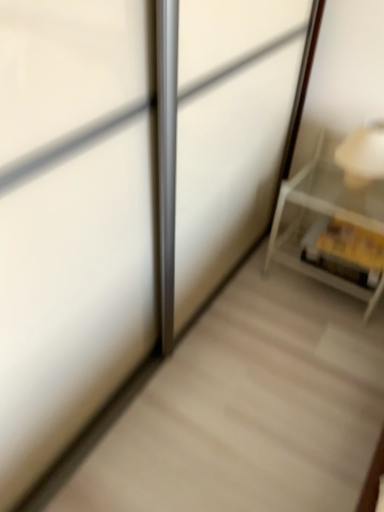
The height and width of the screenshot is (512, 384). Describe the element at coordinates (334, 230) in the screenshot. I see `white glossy side table at right` at that location.

You are a GUI agent. You are given a task and a screenshot of the screen. Output one action in this format:
    pyautogui.click(x=<x>, y=<y>)
    Task: Click on the white glossy side table at right
    Image resolution: width=384 pixels, height=512 pixels.
    Given the screenshot: What is the action you would take?
    pyautogui.click(x=334, y=230)

Identify the location of white glossy side table at right. This screenshot has height=512, width=384. (334, 230).